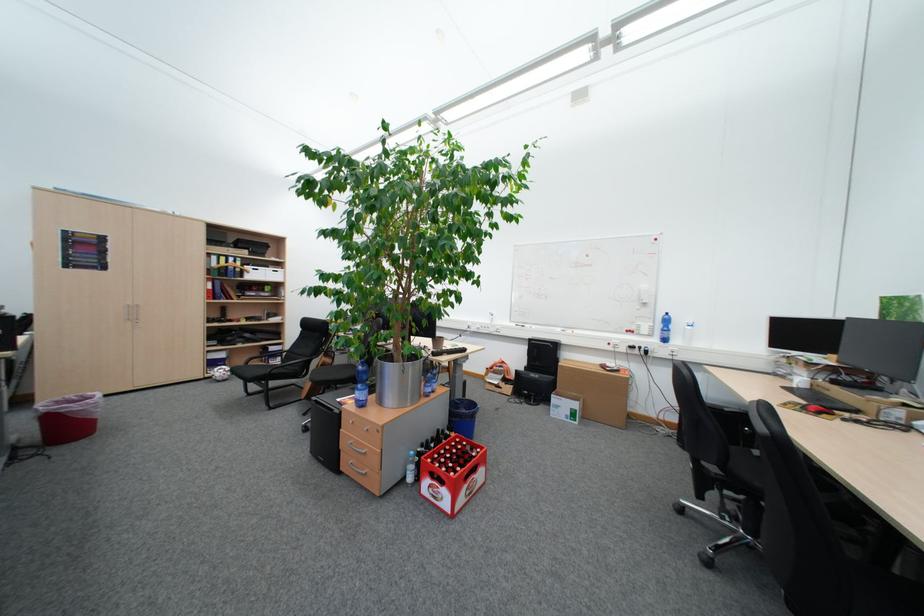
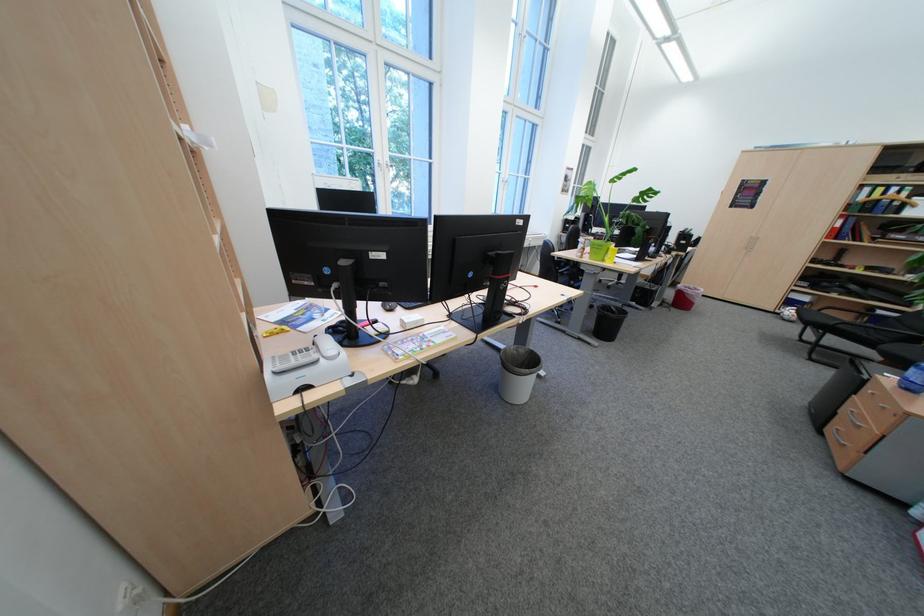
Find the pixel in the second image that matches pixel 228 376 in the first image.

(798, 314)